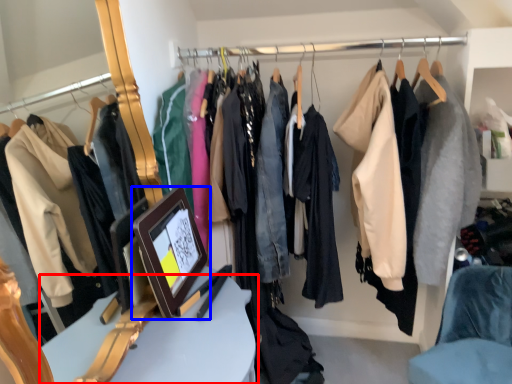
Question: Which of the following is the farthest to the observer, furniture (highlighted by a red box) or picture frame (highlighted by a blue box)?

Choices:
 (A) furniture
 (B) picture frame

Answer: (B)